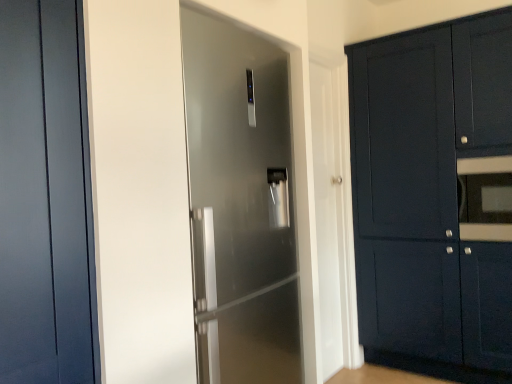
This screenshot has height=384, width=512. What do you see at coordinates (485, 198) in the screenshot?
I see `matte black oven at right` at bounding box center [485, 198].

At what (x,y) coordinates should I click in order to perform the action: click on matte dark blue door at left, the second door when ordered from back to front. Please return your answer as a coordinate pair (x, y). This screenshot has height=384, width=512. Looking at the image, I should click on pos(45,197).

Identify the location of matte dark blue cabinet at right. This screenshot has width=512, height=384. (434, 191).

Describe the element at coordinates (240, 205) in the screenshot. I see `satin silver refrigerator at center, acting as the second door starting from the front` at that location.

Find the location of a particular element. This screenshot has width=512, height=384. matte black oven at right is located at coordinates coord(485,198).

From the image's perspective, is matte dark blue cabinet at right positioned above or below matte dark blue door at left, the first door when ordered from front to back?

Clearly, from the image's perspective, matte dark blue cabinet at right is below matte dark blue door at left, the first door when ordered from front to back.

Is matte dark blue cabinet at right oriented towards matte dark blue door at left, the 1th door from the left?

Yes, matte dark blue cabinet at right is facing matte dark blue door at left, the 1th door from the left.

Can you see matte dark blue cabinet at right touching matte dark blue door at left, the first door when ordered from front to back?

matte dark blue cabinet at right is not next to matte dark blue door at left, the first door when ordered from front to back, and they're not touching.

Considering the sizes of matte dark blue cabinet at right and matte dark blue door at left, the first door when ordered from front to back, in the image, is matte dark blue cabinet at right wider or thinner than matte dark blue door at left, the first door when ordered from front to back,?

Considering their sizes, matte dark blue cabinet at right looks broader than matte dark blue door at left, the first door when ordered from front to back.

From the picture: Can you tell me how much satin silver refrigerator at center, the 1th door from the right, and matte dark blue cabinet at right differ in facing direction?

They differ by 89.6 degrees in their facing directions.

Who is shorter, satin silver refrigerator at center, acting as the second door starting from the front, or matte dark blue cabinet at right?

satin silver refrigerator at center, acting as the second door starting from the front.

Considering the relative sizes of satin silver refrigerator at center, the 1th door from the right, and matte dark blue cabinet at right in the image provided, is satin silver refrigerator at center, the 1th door from the right, smaller than matte dark blue cabinet at right?

Correct, satin silver refrigerator at center, the 1th door from the right, occupies less space than matte dark blue cabinet at right.

From the image's perspective, is matte black oven at right positioned above or below satin silver refrigerator at center, which is the first door in back-to-front order?

Based on their image positions, matte black oven at right is located above satin silver refrigerator at center, which is the first door in back-to-front order.

Looking at this image, considering the sizes of objects matte black oven at right and satin silver refrigerator at center, which appears as the 2th door when viewed from the left, in the image provided, who is smaller, matte black oven at right or satin silver refrigerator at center, which appears as the 2th door when viewed from the left,?

matte black oven at right.

Can satin silver refrigerator at center, which appears as the 2th door when viewed from the left, be found inside matte black oven at right?

No, satin silver refrigerator at center, which appears as the 2th door when viewed from the left, is not a part of matte black oven at right.

Is matte black oven at right directly adjacent to satin silver refrigerator at center, which appears as the 2th door when viewed from the left?

They are not placed beside each other.

Is matte black oven at right located outside matte dark blue cabinet at right?

No, most part of matte black oven at right lies within matte dark blue cabinet at right.

In the image, is matte black oven at right on the left side or the right side of matte dark blue cabinet at right?

Based on their positions, matte black oven at right is located to the right of matte dark blue cabinet at right.

Is matte black oven at right shorter than matte dark blue cabinet at right?

Yes.

You are a GUI agent. You are given a task and a screenshot of the screen. Output one action in this format:
    pyautogui.click(x=<x>, y=<y>)
    Task: Click on the door in front of the satin silver refrigerator at center, which appears as the 2th door when viewed from the left
    The width and height of the screenshot is (512, 384).
    Given the screenshot: What is the action you would take?
    pos(45,197)

Considering the points (286, 54) and (52, 363), which point is behind, point (286, 54) or point (52, 363)?

The point (286, 54) is more distant.

Which object is more forward, satin silver refrigerator at center, which is the first door in back-to-front order, or matte dark blue door at left, the second door when ordered from back to front?

matte dark blue door at left, the second door when ordered from back to front.

Considering the sizes of objects satin silver refrigerator at center, the 1th door from the right, and matte dark blue door at left, the second door when ordered from back to front, in the image provided, who is wider, satin silver refrigerator at center, the 1th door from the right, or matte dark blue door at left, the second door when ordered from back to front,?

With larger width is satin silver refrigerator at center, the 1th door from the right.

Which is behind, matte dark blue door at left, the second door when ordered from back to front, or matte black oven at right?

Positioned behind is matte black oven at right.

Considering the positions of point (52, 304) and point (458, 171), is point (52, 304) closer or farther from the camera than point (458, 171)?

Clearly, point (52, 304) is closer to the camera than point (458, 171).

Does matte dark blue cabinet at right lie in front of satin silver refrigerator at center, which appears as the 2th door when viewed from the left?

No, it is not.

Which object is positioned more to the right, matte dark blue cabinet at right or satin silver refrigerator at center, which appears as the 2th door when viewed from the left?

From the viewer's perspective, matte dark blue cabinet at right appears more on the right side.

Considering the sizes of objects matte dark blue cabinet at right and satin silver refrigerator at center, which is the first door in back-to-front order, in the image provided, who is shorter, matte dark blue cabinet at right or satin silver refrigerator at center, which is the first door in back-to-front order,?

Standing shorter between the two is satin silver refrigerator at center, which is the first door in back-to-front order.

Is satin silver refrigerator at center, which appears as the 2th door when viewed from the left, surrounded by matte dark blue cabinet at right?

No, satin silver refrigerator at center, which appears as the 2th door when viewed from the left, is located outside of matte dark blue cabinet at right.

Image resolution: width=512 pixels, height=384 pixels. I want to click on door that is the 2nd object located in front of the matte dark blue cabinet at right, so click(x=45, y=197).

Identify the location of door below the matte dark blue cabinet at right (from a real-world perspective). (240, 205).

When comparing their distances from matte dark blue cabinet at right, does matte dark blue door at left, the 1th door from the left, or satin silver refrigerator at center, which appears as the 2th door when viewed from the left, seem closer?

satin silver refrigerator at center, which appears as the 2th door when viewed from the left.

Based on the photo, estimate the real-world distances between objects in this image. Which object is further from matte dark blue cabinet at right, matte dark blue door at left, the second door when ordered from back to front, or matte black oven at right?

Based on the image, matte dark blue door at left, the second door when ordered from back to front, appears to be further to matte dark blue cabinet at right.

When comparing their distances from matte dark blue door at left, the second door when ordered from back to front, does satin silver refrigerator at center, which is the first door in back-to-front order, or matte black oven at right seem closer?

Among the two, satin silver refrigerator at center, which is the first door in back-to-front order, is located nearer to matte dark blue door at left, the second door when ordered from back to front.

Based on their spatial positions, is satin silver refrigerator at center, acting as the second door starting from the front, or matte dark blue cabinet at right closer to matte dark blue door at left, the first door when ordered from front to back?

satin silver refrigerator at center, acting as the second door starting from the front.

Looking at this image, which object lies nearer to the anchor point matte black oven at right, matte dark blue cabinet at right or matte dark blue door at left, the second door when ordered from back to front?

matte dark blue cabinet at right is positioned closer to the anchor matte black oven at right.

Considering their positions, is matte dark blue cabinet at right positioned closer to matte black oven at right than satin silver refrigerator at center, which appears as the 2th door when viewed from the left?

The object closer to matte black oven at right is matte dark blue cabinet at right.

Looking at the image, which one is located further to matte black oven at right, matte dark blue door at left, which is counted as the 2th door, starting from the right, or matte dark blue cabinet at right?

The object further to matte black oven at right is matte dark blue door at left, which is counted as the 2th door, starting from the right.

Which object lies further to the anchor point satin silver refrigerator at center, the 1th door from the right, matte black oven at right or matte dark blue door at left, the 1th door from the left?

matte black oven at right is positioned further to the anchor satin silver refrigerator at center, the 1th door from the right.

This screenshot has height=384, width=512. What are the coordinates of `door between matte dark blue door at left, the first door when ordered from front to back, and matte dark blue cabinet at right, in the horizontal direction` in the screenshot? It's located at (240, 205).

At what (x,y) coordinates should I click in order to perform the action: click on cabinetry between matte dark blue door at left, the second door when ordered from back to front, and matte black oven at right, in the horizontal direction. Please return your answer as a coordinate pair (x, y). This screenshot has height=384, width=512. Looking at the image, I should click on (434, 191).

The width and height of the screenshot is (512, 384). What are the coordinates of `cabinetry situated between satin silver refrigerator at center, the 1th door from the right, and matte black oven at right from left to right` in the screenshot? It's located at (434, 191).

This screenshot has width=512, height=384. In order to click on door located between matte dark blue door at left, the first door when ordered from front to back, and matte black oven at right in the left-right direction in this screenshot , I will do `click(240, 205)`.